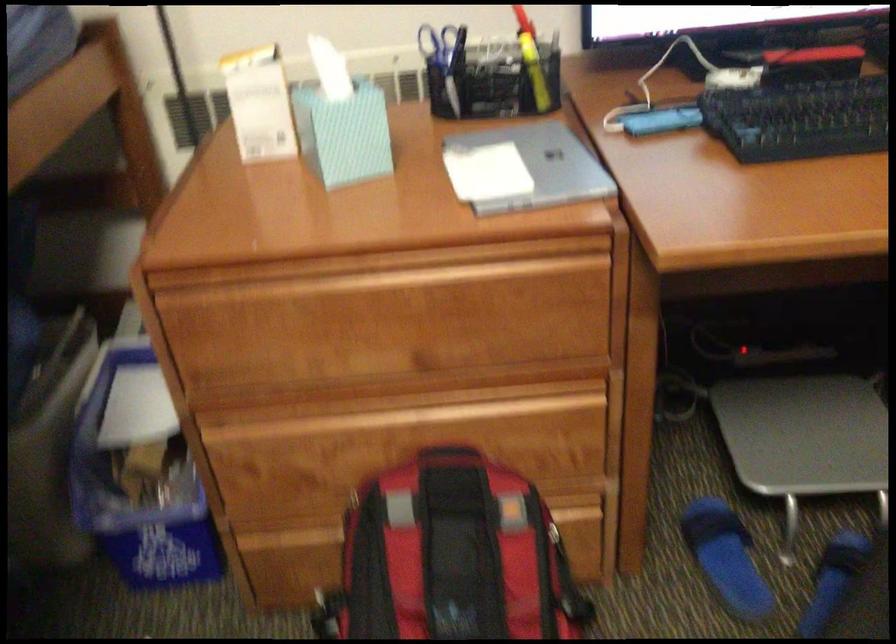
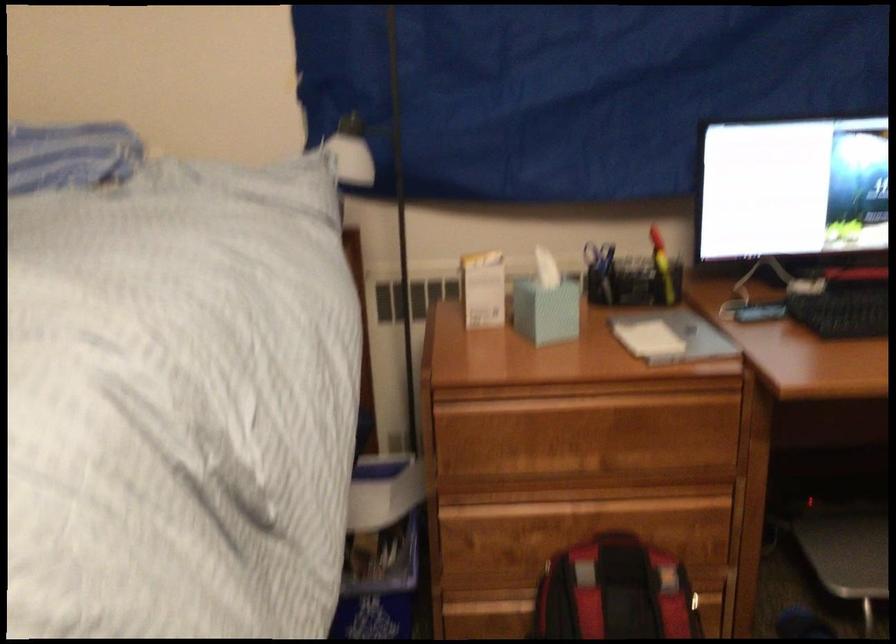
Find the pixel in the second image that matches point (254, 292) in the first image.

(497, 406)